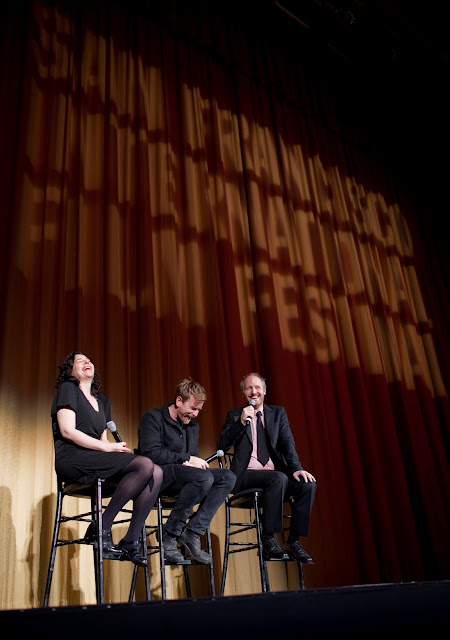
At what (x,y) coordinates should I click in order to perform the action: click on chair legs. Please return your answer as a coordinate pair (x, y). This screenshot has height=640, width=450. Looking at the image, I should click on (100, 582), (45, 589), (148, 588), (162, 587), (213, 580), (222, 562), (261, 573).